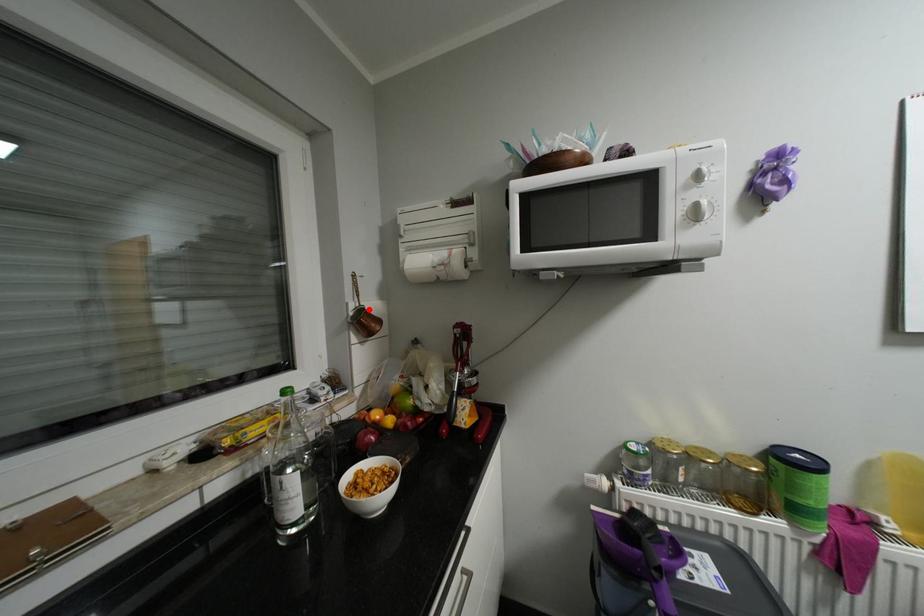
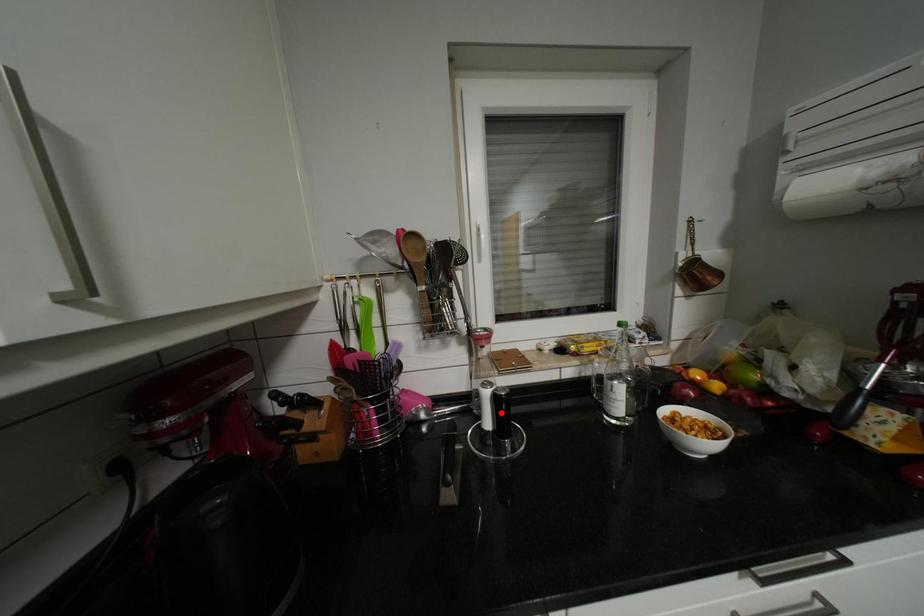
I am providing you with two images of the same scene from different viewpoints. A red point is marked on the first image and another point is marked on the second image. Are the points marked in image1 and image2 representing the same 3D position?

No